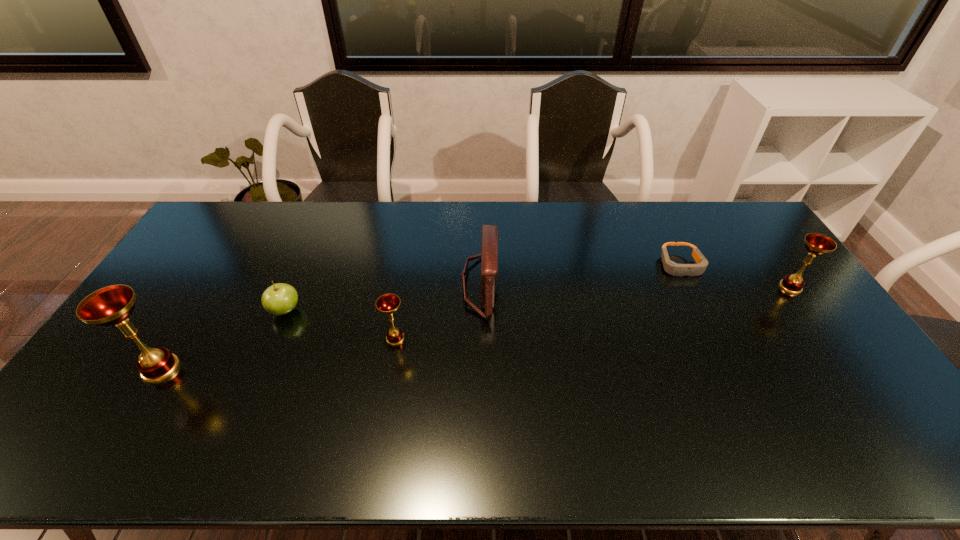
Find the location of a particular element. This screenshot has width=960, height=540. the tallest chalice is located at coordinates (112, 305).

Image resolution: width=960 pixels, height=540 pixels. In order to click on the leftmost chalice in this screenshot , I will do point(112,305).

You are a GUI agent. You are given a task and a screenshot of the screen. Output one action in this format:
    pyautogui.click(x=<x>, y=<y>)
    Task: Click on the fourth object from right to left
    The image size is (960, 540).
    Given the screenshot: What is the action you would take?
    pyautogui.click(x=388, y=304)

This screenshot has width=960, height=540. Find the location of `the second nearest object`. the second nearest object is located at coordinates (388, 304).

This screenshot has width=960, height=540. Identify the location of the second tallest chalice. (816, 244).

This screenshot has width=960, height=540. Identify the location of the farthest chalice. (816, 244).

The image size is (960, 540). I want to click on the fifth object from left to right, so click(672, 268).

You are a GUI agent. You are given a task and a screenshot of the screen. Output one action in this format:
    pyautogui.click(x=<x>, y=<y>)
    Task: Click on the shortest object
    
    Given the screenshot: What is the action you would take?
    672,268

The width and height of the screenshot is (960, 540). I want to click on the fourth object from left to right, so click(489, 240).

Locate an element on the screen. This screenshot has height=540, width=960. the fifth tallest object is located at coordinates [x=279, y=299].